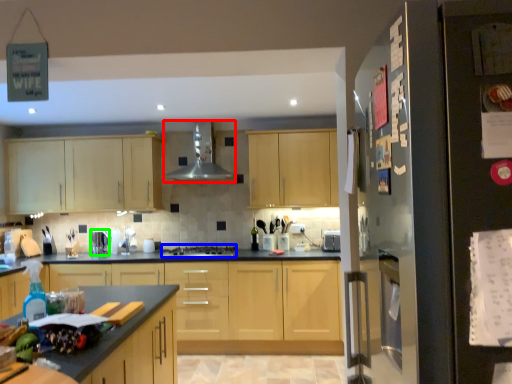
Question: Considering the real-world distances, which object is closest to exhaust hood (highlighted by a red box)? gas stove (highlighted by a blue box) or appliance (highlighted by a green box).

Choices:
 (A) gas stove
 (B) appliance

Answer: (A)